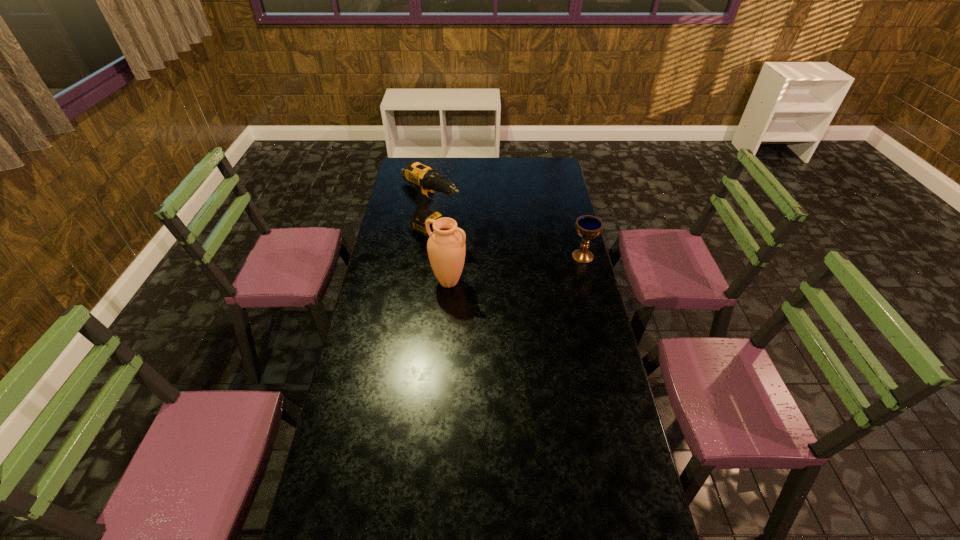
This screenshot has width=960, height=540. What are the coordinates of `free space on the desktop that is between the urn and the chalice and is positioned on the head of the electric shaver` in the screenshot? It's located at (518, 268).

The image size is (960, 540). Identify the location of free space on the desktop that is between the nearest object and the third farthest object and is positioned at the tip of the second farthest object. click(x=516, y=269).